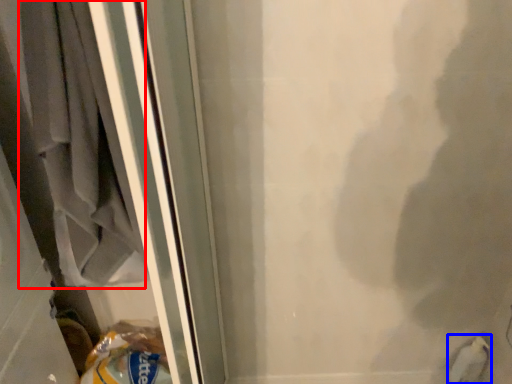
Question: Which point is closer to the camera, laundry (highlighted by a red box) or animal (highlighted by a blue box)?

Choices:
 (A) laundry
 (B) animal

Answer: (A)